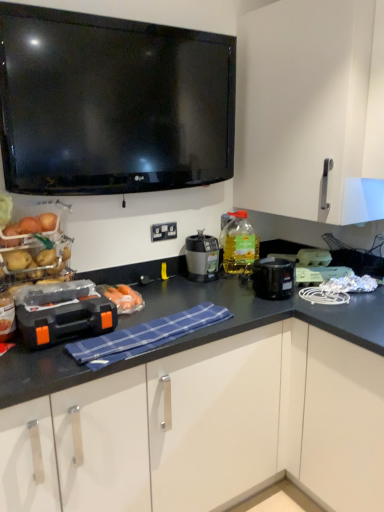
The width and height of the screenshot is (384, 512). In order to click on translucent plastic bottle at upper right in this screenshot , I will do `click(239, 244)`.

Describe the element at coordinates (273, 278) in the screenshot. This screenshot has height=512, width=384. I see `black plastic slow cooker at lower right` at that location.

Locate an element on the screen. The width and height of the screenshot is (384, 512). orange plastic toolbox at center, marked as the third appliance in a right-to-left arrangement is located at coordinates (65, 318).

The height and width of the screenshot is (512, 384). What do you see at coordinates (313, 257) in the screenshot?
I see `clear plastic egg carton at upper right, the 2th appliance positioned from the right` at bounding box center [313, 257].

This screenshot has width=384, height=512. In order to click on green plastic toaster at center, placed as the 1th appliance when sorted from right to left in this screenshot , I will do `click(319, 274)`.

The height and width of the screenshot is (512, 384). Describe the element at coordinates (144, 336) in the screenshot. I see `blue checkered cloth at center` at that location.

You are a GUI agent. You are given a task and a screenshot of the screen. Output one action in this format:
    pyautogui.click(x=<x>, y=<y>)
    Task: Click on the white matte cabinet at upper right
    This screenshot has width=384, height=512.
    Given the screenshot: What is the action you would take?
    pyautogui.click(x=311, y=109)

At what (x,y) coordinates should I click in order to perform the action: click on bottle below the white matte cabinet at upper right (from the image's perspective). Please return your answer as a coordinate pair (x, y). Looking at the image, I should click on (239, 244).

From a real-world perspective, who is located lower, translucent plastic bottle at upper right or white matte cabinet at upper right?

From a 3D spatial view, translucent plastic bottle at upper right is below.

Based on the photo, can you tell me how much translucent plastic bottle at upper right and white matte cabinet at upper right differ in facing direction?

They differ by 62.9 degrees in their facing directions.

Does translucent plastic bottle at upper right have a lesser width compared to white matte cabinet at upper right?

Correct, the width of translucent plastic bottle at upper right is less than that of white matte cabinet at upper right.

Which point is more forward, [269,276] or [323,263]?

Positioned in front is point [269,276].

Could you tell me if black plastic slow cooker at lower right is facing clear plastic egg carton at upper right, acting as the third appliance starting from the front?

No, black plastic slow cooker at lower right is not oriented towards clear plastic egg carton at upper right, acting as the third appliance starting from the front.

From a real-world perspective, which object rests below the other?

black plastic slow cooker at lower right.

Between clear plastic egg carton at upper right, acting as the third appliance starting from the front, and blue checkered cloth at center, which one appears on the right side from the viewer's perspective?

clear plastic egg carton at upper right, acting as the third appliance starting from the front, is more to the right.

Is the position of clear plastic egg carton at upper right, positioned as the first appliance in back-to-front order, less distant than that of blue checkered cloth at center?

No, clear plastic egg carton at upper right, positioned as the first appliance in back-to-front order, is further to the viewer.

Is clear plastic egg carton at upper right, the 2th appliance positioned from the right, oriented away from blue checkered cloth at center?

No.

Are clear plastic egg carton at upper right, which ranks as the 2th appliance in left-to-right order, and blue checkered cloth at center making contact?

No, clear plastic egg carton at upper right, which ranks as the 2th appliance in left-to-right order, is not with blue checkered cloth at center.

Is blue checkered cloth at center oriented away from green plastic toaster at center, positioned as the third appliance in left-to-right order?

That's not correct — blue checkered cloth at center is not looking away from green plastic toaster at center, positioned as the third appliance in left-to-right order.

Is blue checkered cloth at center closer to camera compared to green plastic toaster at center, acting as the second appliance starting from the front?

Yes, it is.

Can you confirm if blue checkered cloth at center is wider than green plastic toaster at center, placed as the 1th appliance when sorted from right to left?

Correct, the width of blue checkered cloth at center exceeds that of green plastic toaster at center, placed as the 1th appliance when sorted from right to left.

Considering the sizes of blue checkered cloth at center and green plastic toaster at center, acting as the second appliance starting from the front, in the image, is blue checkered cloth at center taller or shorter than green plastic toaster at center, acting as the second appliance starting from the front,?

blue checkered cloth at center is shorter than green plastic toaster at center, acting as the second appliance starting from the front.

Does translucent plastic bottle at upper right contain matte black blender at center?

No, matte black blender at center is located outside of translucent plastic bottle at upper right.

From a real-world perspective, is translucent plastic bottle at upper right physically located above or below matte black blender at center?

Clearly, from a real-world perspective, translucent plastic bottle at upper right is above matte black blender at center.

Are translucent plastic bottle at upper right and matte black blender at center located far from each other?

No, translucent plastic bottle at upper right is not far from matte black blender at center.

From the image's perspective, is translucent plastic bottle at upper right on matte black blender at center?

Indeed, from the image's perspective, translucent plastic bottle at upper right is shown above matte black blender at center.

From a real-world perspective, between blue checkered cloth at center and translucent plastic bottle at upper right, who is vertically lower?

blue checkered cloth at center.

Could translucent plastic bottle at upper right be considered to be inside blue checkered cloth at center?

No, translucent plastic bottle at upper right is not surrounded by blue checkered cloth at center.

Looking at this image, is blue checkered cloth at center looking in the opposite direction of translucent plastic bottle at upper right?

No, blue checkered cloth at center is not facing away from translucent plastic bottle at upper right.

Locate an element on the screen. bottle above the blue checkered cloth at center (from a real-world perspective) is located at coordinates (239, 244).

Is black plastic slow cooker at lower right at the back of blue checkered cloth at center?

blue checkered cloth at center is not turned away from black plastic slow cooker at lower right.

What's the angular difference between blue checkered cloth at center and black plastic slow cooker at lower right's facing directions?

They differ by 5.04 degrees in their facing directions.

Considering the relative positions of blue checkered cloth at center and black plastic slow cooker at lower right in the image provided, is blue checkered cloth at center behind black plastic slow cooker at lower right?

No, it is in front of black plastic slow cooker at lower right.

How far apart are blue checkered cloth at center and black plastic slow cooker at lower right?

blue checkered cloth at center and black plastic slow cooker at lower right are 18.35 inches apart.

Find the location of a particular element. cabinetry above the translucent plastic bottle at upper right (from a real-world perspective) is located at coordinates (311, 109).

From the black plastic slow cooker at lower right, count 1st appliance to the right and point to it. Please provide its 2D coordinates.

[(313, 257)]

Estimate the real-world distances between objects in this image. Which object is closer to black plastic slow cooker at lower right, green plastic toaster at center, acting as the second appliance starting from the front, or matte black blender at center?

Based on the image, green plastic toaster at center, acting as the second appliance starting from the front, appears to be nearer to black plastic slow cooker at lower right.

From the image, which object appears to be nearer to white matte cabinet at upper right, green plastic toaster at center, placed as the 1th appliance when sorted from right to left, or clear plastic egg carton at upper right, acting as the third appliance starting from the front?

Based on the image, clear plastic egg carton at upper right, acting as the third appliance starting from the front, appears to be nearer to white matte cabinet at upper right.

Looking at the image, which one is located closer to translucent plastic bottle at upper right, white plastic electric outlet at center or blue checkered cloth at center?

white plastic electric outlet at center lies closer to translucent plastic bottle at upper right than the other object.

Estimate the real-world distances between objects in this image. Which object is further from black plastic slow cooker at lower right, green plastic toaster at center, placed as the 1th appliance when sorted from right to left, or orange plastic toolbox at center, acting as the third appliance starting from the back?

orange plastic toolbox at center, acting as the third appliance starting from the back, is further to black plastic slow cooker at lower right.

Based on the photo, estimate the real-world distances between objects in this image. Which object is further from black plastic slow cooker at lower right, white matte cabinet at upper right or green plastic toaster at center, acting as the second appliance starting from the front?

Among the two, white matte cabinet at upper right is located further to black plastic slow cooker at lower right.

When comparing their distances from translucent plastic bottle at upper right, does matte black blender at center or blue checkered cloth at center seem closer?

matte black blender at center.

Which object lies further to the anchor point white plastic electric outlet at center, blue checkered cloth at center or white matte cabinet at upper right?

The object further to white plastic electric outlet at center is white matte cabinet at upper right.

From the image, which object appears to be nearer to blue checkered cloth at center, clear plastic egg carton at upper right, which ranks as the 2th appliance in left-to-right order, or white plastic electric outlet at center?

white plastic electric outlet at center is closer to blue checkered cloth at center.

The height and width of the screenshot is (512, 384). I want to click on kitchen appliance between white plastic electric outlet at center and green plastic toaster at center, which ranks as the 2th appliance in back-to-front order, in the horizontal direction, so click(202, 257).

I want to click on kitchen appliance between white matte cabinet at upper right and green plastic toaster at center, placed as the 1th appliance when sorted from right to left, from top to bottom, so click(202, 257).

This screenshot has width=384, height=512. Find the location of `home appliance between orange plastic toolbox at center, marked as the third appliance in a right-to-left arrangement, and green plastic toaster at center, which ranks as the 2th appliance in back-to-front order, in the horizontal direction`. home appliance between orange plastic toolbox at center, marked as the third appliance in a right-to-left arrangement, and green plastic toaster at center, which ranks as the 2th appliance in back-to-front order, in the horizontal direction is located at coordinates (273, 278).

I want to click on home appliance between blue checkered cloth at center and translucent plastic bottle at upper right from front to back, so click(x=273, y=278).